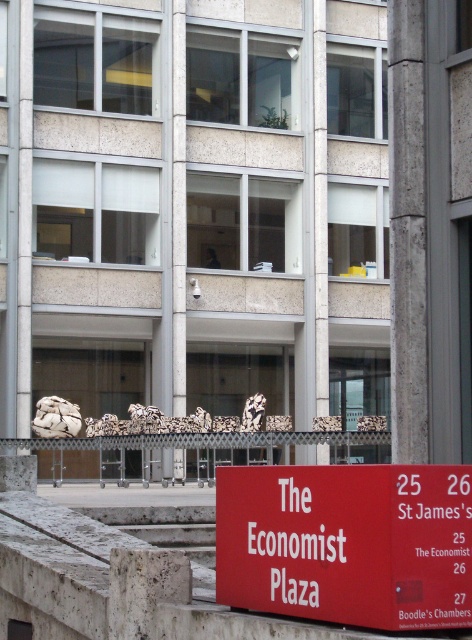
Who is taller, red matte sign at lower center or metallic silver rail at center?

With more height is metallic silver rail at center.

Is red matte sign at lower center to the right of metallic silver rail at center from the viewer's perspective?

Yes, red matte sign at lower center is to the right of metallic silver rail at center.

Which is in front, point (309, 513) or point (126, 458)?

Positioned in front is point (309, 513).

Where is `red matte sign at lower center`? The height and width of the screenshot is (640, 472). red matte sign at lower center is located at coordinates click(347, 541).

Is metallic silver rail at center wider than white marble pillar at center?

Indeed, metallic silver rail at center has a greater width compared to white marble pillar at center.

Is metallic silver rail at center thinner than white marble pillar at center?

In fact, metallic silver rail at center might be wider than white marble pillar at center.

Find the location of a particular element. metallic silver rail at center is located at coordinates (191, 452).

Identify the location of red matte sign at lower center. (347, 541).

Where is `red matte sign at lower center`? red matte sign at lower center is located at coordinates (347, 541).